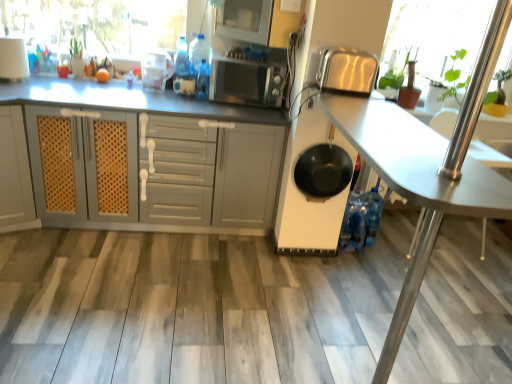
Identify the location of vacant area in front of transparent plastic container at upper center, the second appliance positioned from the left. (144, 96).